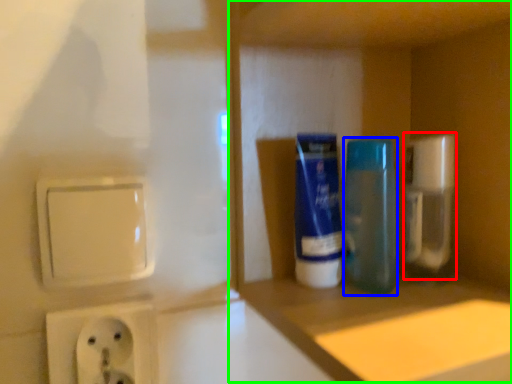
Question: Which object is the farthest from cleaning product (highlighted by a red box)? Choose among these: mouthwash (highlighted by a blue box) or cabinet (highlighted by a green box).

Choices:
 (A) mouthwash
 (B) cabinet

Answer: (B)